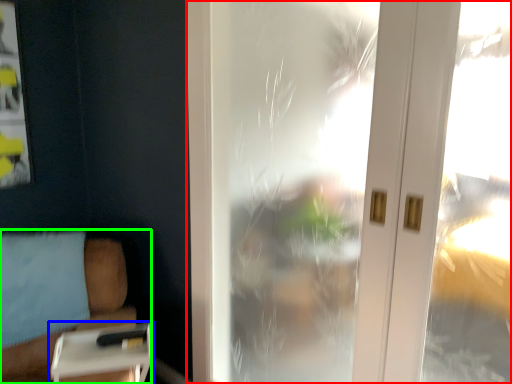
Question: Estimate the real-world distances between objects in this image. Which object is closer to window (highlighted by a red box), table (highlighted by a blue box) or furniture (highlighted by a green box)?

Choices:
 (A) table
 (B) furniture

Answer: (B)